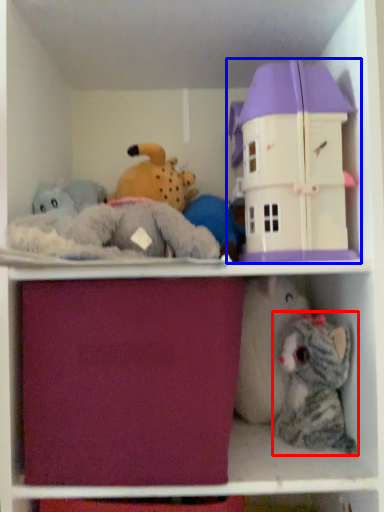
Question: Which point is closer to the camera, toy (highlighted by a red box) or toy (highlighted by a blue box)?

Choices:
 (A) toy
 (B) toy

Answer: (B)